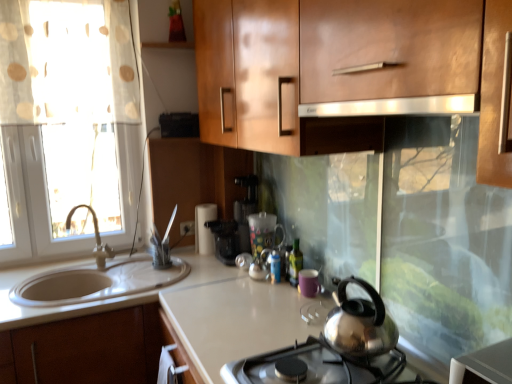
Question: Considering the relative sizes of matte silver faucet at left and satin silver exhaust hood at upper center in the image provided, is matte silver faucet at left taller than satin silver exhaust hood at upper center?

Choices:
 (A) no
 (B) yes

Answer: (B)

Question: Are matte silver faucet at left and satin silver exhaust hood at upper center beside each other?

Choices:
 (A) yes
 (B) no

Answer: (B)

Question: Considering the relative positions of matte silver faucet at left and satin silver exhaust hood at upper center in the image provided, is matte silver faucet at left in front of satin silver exhaust hood at upper center?

Choices:
 (A) yes
 (B) no

Answer: (B)

Question: Is matte silver faucet at left at the right side of satin silver exhaust hood at upper center?

Choices:
 (A) no
 (B) yes

Answer: (A)

Question: Is matte silver faucet at left not near satin silver exhaust hood at upper center?

Choices:
 (A) yes
 (B) no

Answer: (A)

Question: Considering their positions, is matte silver faucet at left located in front of or behind polished stainless steel kettle at center?

Choices:
 (A) behind
 (B) front

Answer: (A)

Question: In terms of width, does matte silver faucet at left look wider or thinner when compared to polished stainless steel kettle at center?

Choices:
 (A) wide
 (B) thin

Answer: (B)

Question: Considering the positions of matte silver faucet at left and polished stainless steel kettle at center in the image, is matte silver faucet at left bigger or smaller than polished stainless steel kettle at center?

Choices:
 (A) small
 (B) big

Answer: (A)

Question: Considering the positions of point (98, 236) and point (330, 357), is point (98, 236) closer or farther from the camera than point (330, 357)?

Choices:
 (A) farther
 (B) closer

Answer: (A)

Question: Looking at their shapes, would you say purple matte mug at center, which is the 3th appliance from left to right, is wider or thinner than black plastic coffee machine at center?

Choices:
 (A) wide
 (B) thin

Answer: (B)

Question: From their relative heights in the image, would you say purple matte mug at center, the third appliance from the back, is taller or shorter than black plastic coffee machine at center?

Choices:
 (A) short
 (B) tall

Answer: (A)

Question: Does point (300, 271) appear closer or farther from the camera than point (241, 200)?

Choices:
 (A) closer
 (B) farther

Answer: (A)

Question: Would you say purple matte mug at center, placed as the 1th appliance when sorted from right to left, is inside or outside black plastic coffee machine at center?

Choices:
 (A) outside
 (B) inside

Answer: (A)

Question: From the image's perspective, is white glossy countertop at lower left, the 1th countertop positioned from the left, positioned above or below black plastic coffee machine at center?

Choices:
 (A) below
 (B) above

Answer: (A)

Question: Considering the positions of white glossy countertop at lower left, arranged as the second countertop when viewed from the right, and black plastic coffee machine at center in the image, is white glossy countertop at lower left, arranged as the second countertop when viewed from the right, taller or shorter than black plastic coffee machine at center?

Choices:
 (A) short
 (B) tall

Answer: (A)